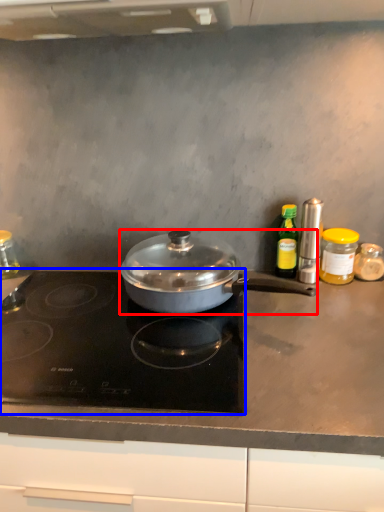
Question: Which object appears closest to the camera in this image, kitchen appliance (highlighted by a red box) or gas stove (highlighted by a blue box)?

Choices:
 (A) kitchen appliance
 (B) gas stove

Answer: (B)